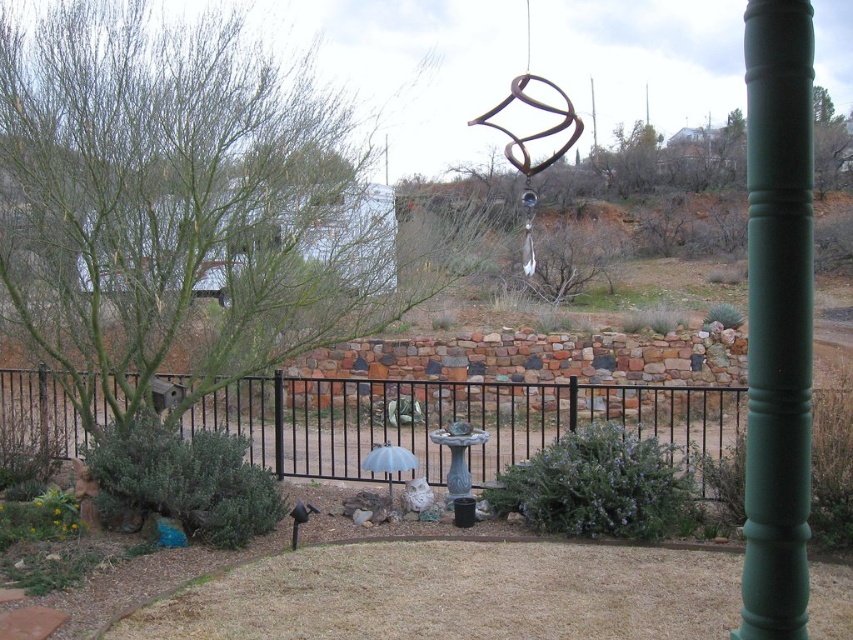
Between point (300, 392) and point (368, 464), which one is positioned behind?

The point (300, 392) is behind.

What do you see at coordinates (462, 419) in the screenshot? I see `black metal fence at center` at bounding box center [462, 419].

Image resolution: width=853 pixels, height=640 pixels. Find the location of `black metal fence at center`. black metal fence at center is located at coordinates (462, 419).

Is point (166, 424) closer to viewer compared to point (793, 285)?

No.

Which is more to the right, green leafy tree at center or green painted wood post at right?

Positioned to the right is green painted wood post at right.

Between point (216, 292) and point (766, 342), which one is positioned in front?

Point (766, 342) is more forward.

Locate an element on the screen. green leafy tree at center is located at coordinates (186, 208).

Can you confirm if green leafy tree at center is wider than black metal fence at center?

Incorrect, green leafy tree at center's width does not surpass black metal fence at center's.

Between green leafy tree at center and black metal fence at center, which one is positioned lower?

black metal fence at center

Where is `green leafy tree at center`? The width and height of the screenshot is (853, 640). green leafy tree at center is located at coordinates (186, 208).